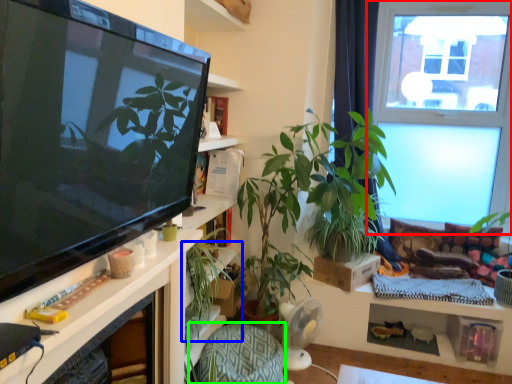
Question: Estimate the real-world distances between objects in this image. Which object is closer to window (highlighted by a red box), houseplant (highlighted by a blue box) or armchair (highlighted by a green box)?

Choices:
 (A) houseplant
 (B) armchair

Answer: (B)